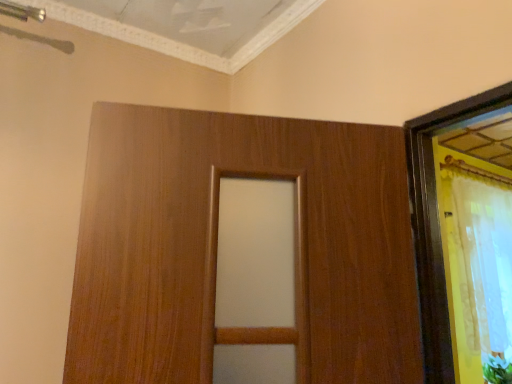
Question: From the image's perspective, does green leafy plant at lower right appear lower than white sheer curtain at right?

Choices:
 (A) no
 (B) yes

Answer: (B)

Question: Can you confirm if green leafy plant at lower right is wider than white sheer curtain at right?

Choices:
 (A) yes
 (B) no

Answer: (A)

Question: Could you tell me if green leafy plant at lower right is turned towards white sheer curtain at right?

Choices:
 (A) no
 (B) yes

Answer: (A)

Question: From a real-world perspective, is green leafy plant at lower right beneath white sheer curtain at right?

Choices:
 (A) yes
 (B) no

Answer: (A)

Question: Is green leafy plant at lower right positioned with its back to white sheer curtain at right?

Choices:
 (A) yes
 (B) no

Answer: (B)

Question: Is white sheer curtain at right located within green leafy plant at lower right?

Choices:
 (A) yes
 (B) no

Answer: (B)

Question: Is white sheer curtain at right far from green leafy plant at lower right?

Choices:
 (A) yes
 (B) no

Answer: (B)

Question: Is white sheer curtain at right smaller than green leafy plant at lower right?

Choices:
 (A) yes
 (B) no

Answer: (B)

Question: Does white sheer curtain at right contain green leafy plant at lower right?

Choices:
 (A) yes
 (B) no

Answer: (B)

Question: Is white sheer curtain at right facing towards green leafy plant at lower right?

Choices:
 (A) yes
 (B) no

Answer: (B)

Question: Does white sheer curtain at right have a greater height compared to green leafy plant at lower right?

Choices:
 (A) no
 (B) yes

Answer: (B)

Question: Is white sheer curtain at right beside green leafy plant at lower right?

Choices:
 (A) no
 (B) yes

Answer: (A)

Question: In the image, is green leafy plant at lower right on the left side or the right side of white sheer curtain at right?

Choices:
 (A) left
 (B) right

Answer: (B)